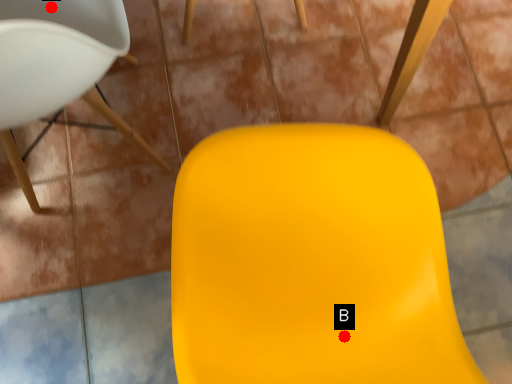
Question: Two points are circled on the image, labeled by A and B beside each circle. Which point is closer to the camera taking this photo?

Choices:
 (A) A is closer
 (B) B is closer

Answer: (B)